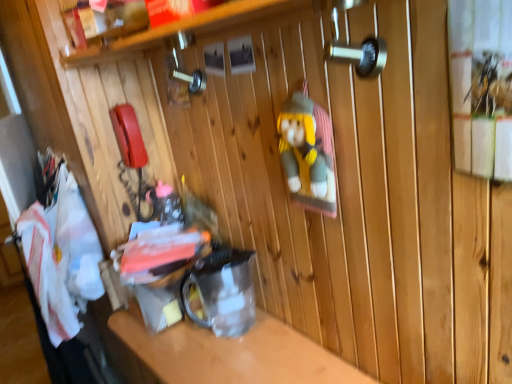
Question: From a real-world perspective, is clear plastic container at center positioned over white fabric at left based on gravity?

Choices:
 (A) yes
 (B) no

Answer: (B)

Question: Are clear plastic container at center and white fabric at left located far from each other?

Choices:
 (A) no
 (B) yes

Answer: (A)

Question: Is clear plastic container at center facing away from white fabric at left?

Choices:
 (A) no
 (B) yes

Answer: (A)

Question: Considering the relative sizes of clear plastic container at center and white fabric at left in the image provided, is clear plastic container at center smaller than white fabric at left?

Choices:
 (A) yes
 (B) no

Answer: (B)

Question: Does clear plastic container at center touch white fabric at left?

Choices:
 (A) no
 (B) yes

Answer: (A)

Question: Considering the relative sizes of clear plastic container at center and white fabric at left in the image provided, is clear plastic container at center bigger than white fabric at left?

Choices:
 (A) yes
 (B) no

Answer: (A)

Question: Is white fabric at left wider than clear plastic container at center?

Choices:
 (A) yes
 (B) no

Answer: (B)

Question: Is clear plastic container at center surrounded by white fabric at left?

Choices:
 (A) yes
 (B) no

Answer: (B)

Question: Is white fabric at left in front of clear plastic container at center?

Choices:
 (A) no
 (B) yes

Answer: (A)

Question: From a real-world perspective, is white fabric at left positioned under clear plastic container at center based on gravity?

Choices:
 (A) yes
 (B) no

Answer: (B)

Question: Is white fabric at left next to clear plastic container at center?

Choices:
 (A) yes
 (B) no

Answer: (B)

Question: From the image's perspective, does white fabric at left appear higher than clear plastic container at center?

Choices:
 (A) no
 (B) yes

Answer: (B)

Question: In terms of height, does white fabric at left look taller or shorter compared to clear plastic container at center?

Choices:
 (A) tall
 (B) short

Answer: (B)